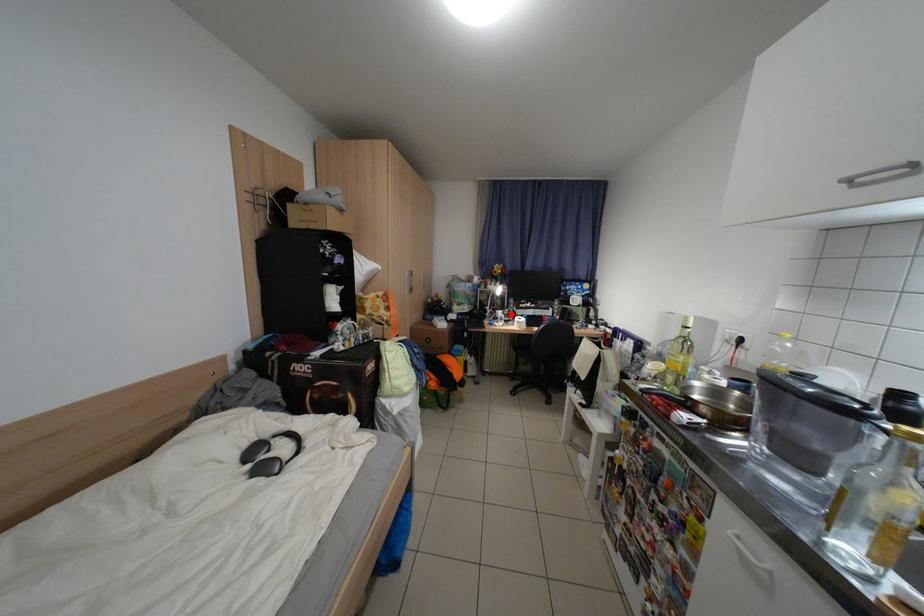
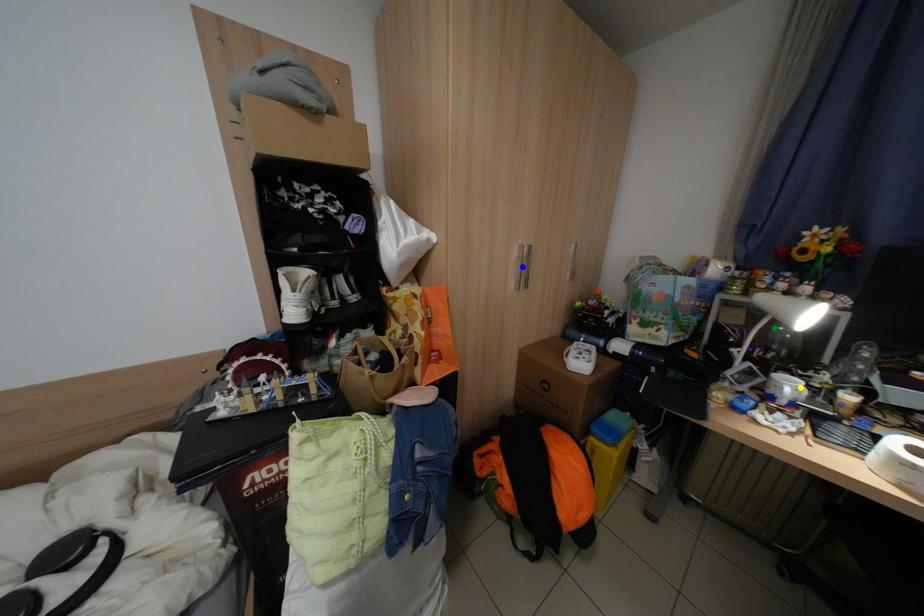
Question: I am providing you with two images of the same scene from different viewpoints. A red point is marked on the first image. You are given multiple points on the second image. Which point in image 2 is actually the same real-world point as the red point in image 1?

Choices:
 (A) blue point
 (B) green point
 (C) yellow point

Answer: (C)